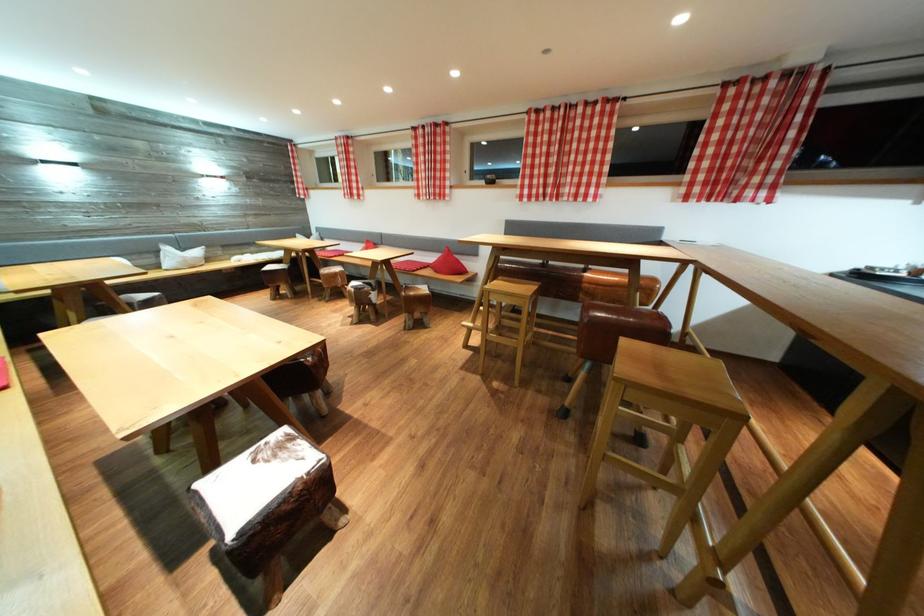
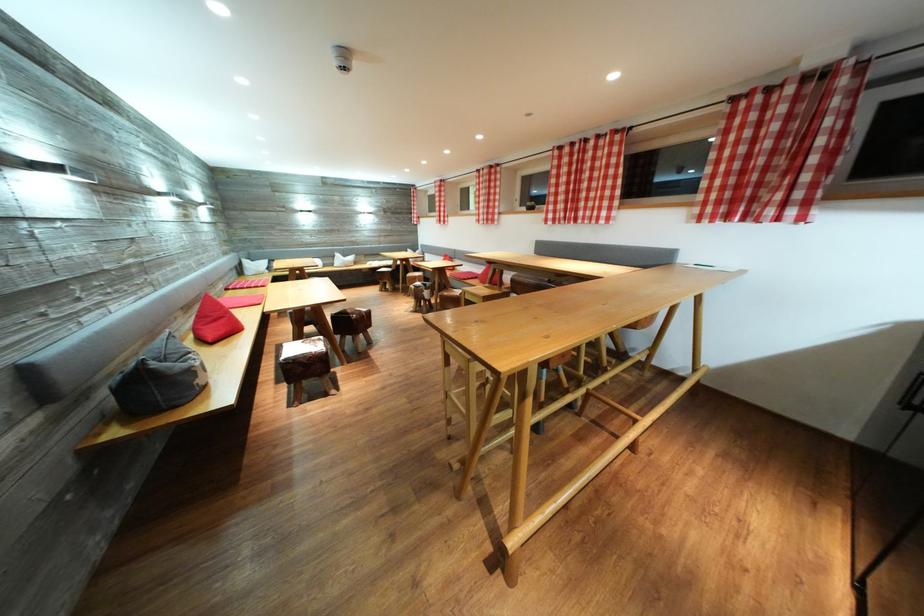
Find the pixel in the second image that matches point (763, 155) in the first image.

(787, 167)